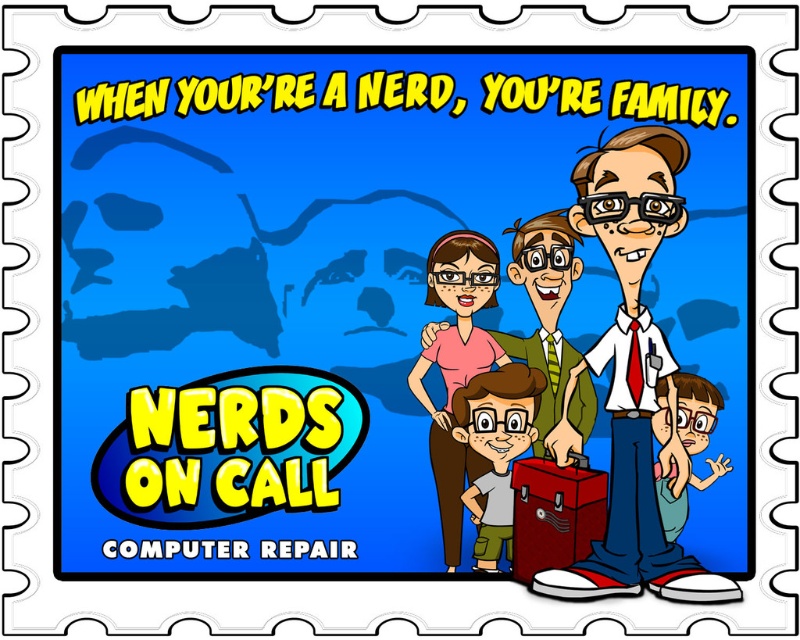
From the picture: Who is more distant from viewer, (516, 168) or (580, 588)?

Point (516, 168)

Locate an element on the screen. This screenshot has width=800, height=640. matte red toolbox at center is located at coordinates (401, 314).

Which is behind, point (668, 570) or point (704, 483)?

Point (704, 483)

Can you confirm if matte white shirt at center is wider than green fabric shirt at lower right?

Correct, the width of matte white shirt at center exceeds that of green fabric shirt at lower right.

Does point (614, 536) lie in front of point (674, 536)?

Yes.

What are the coordinates of `matte white shirt at center` in the screenshot? It's located at 632,378.

Who is taller, pink fabric shirt at center or light brown skin tone at center?

Standing taller between the two is pink fabric shirt at center.

The width and height of the screenshot is (800, 640). Describe the element at coordinates (456, 365) in the screenshot. I see `pink fabric shirt at center` at that location.

Is point (456, 372) behind point (480, 384)?

That is True.

Locate an element on the screen. pink fabric shirt at center is located at coordinates (456, 365).